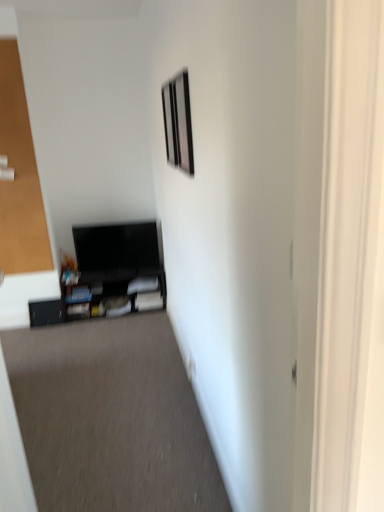
The width and height of the screenshot is (384, 512). What do you see at coordinates (111, 418) in the screenshot?
I see `black cardboard box at lower left` at bounding box center [111, 418].

This screenshot has height=512, width=384. I want to click on matte black picture frame at upper center, which is the second picture frame in front-to-back order, so click(170, 122).

The width and height of the screenshot is (384, 512). I want to click on black cardboard box at lower left, so click(x=111, y=418).

Does black cardboard box at lower left turn towards matte black entertainment center at lower left?

No, black cardboard box at lower left is not aimed at matte black entertainment center at lower left.

From a real-world perspective, is black cardboard box at lower left below matte black entertainment center at lower left?

Yes, from a real-world perspective, black cardboard box at lower left is below matte black entertainment center at lower left.

Identify the location of plain in front of the matte black entertainment center at lower left. (111, 418).

Which object is further away from the camera, black cardboard box at lower left or matte black entertainment center at lower left?

matte black entertainment center at lower left is behind.

Is matte black picture frame at upper center, the 1th picture frame from the back, wider or thinner than black cardboard box at lower left?

Clearly, matte black picture frame at upper center, the 1th picture frame from the back, has less width compared to black cardboard box at lower left.

Is there a large distance between matte black picture frame at upper center, which is the first picture frame from left to right, and black cardboard box at lower left?

Indeed, matte black picture frame at upper center, which is the first picture frame from left to right, is not near black cardboard box at lower left.

The image size is (384, 512). Identify the location of picture frame that is the 2nd one when counting upward from the black cardboard box at lower left (from the image's perspective). (170, 122).

Based on the photo, measure the distance between matte black picture frame at upper center, the 1th picture frame from the back, and black cardboard box at lower left.

matte black picture frame at upper center, the 1th picture frame from the back, is 1.63 meters from black cardboard box at lower left.

Locate an element on the screen. This screenshot has height=512, width=384. entertainment center located below the matte black picture frame at upper center, the second picture frame when ordered from right to left (from the image's perspective) is located at coordinates (114, 271).

Considering the positions of objects matte black entertainment center at lower left and matte black picture frame at upper center, which is the second picture frame in front-to-back order, in the image provided, who is more to the left, matte black entertainment center at lower left or matte black picture frame at upper center, which is the second picture frame in front-to-back order,?

matte black entertainment center at lower left.

Is matte black entertainment center at lower left far away from matte black picture frame at upper center, which is the first picture frame from left to right?

Yes.

Can matte black picture frame at upper center, which is the first picture frame from left to right, be found inside matte black entertainment center at lower left?

No, matte black picture frame at upper center, which is the first picture frame from left to right, is not surrounded by matte black entertainment center at lower left.

Between metallic silver picture frame at upper center, arranged as the 2th picture frame when viewed from the back, and matte black picture frame at upper center, the second picture frame when ordered from right to left, which one has less height?

matte black picture frame at upper center, the second picture frame when ordered from right to left, is shorter.

From the image's perspective, which is below, metallic silver picture frame at upper center, marked as the 2th picture frame in a left-to-right arrangement, or matte black picture frame at upper center, which is the second picture frame in front-to-back order?

metallic silver picture frame at upper center, marked as the 2th picture frame in a left-to-right arrangement, from the image's perspective.

What's the angular difference between metallic silver picture frame at upper center, arranged as the 2th picture frame when viewed from the back, and matte black picture frame at upper center, the second picture frame when ordered from right to left,'s facing directions?

The facing directions of metallic silver picture frame at upper center, arranged as the 2th picture frame when viewed from the back, and matte black picture frame at upper center, the second picture frame when ordered from right to left, are 0.0203 degrees apart.

Is metallic silver picture frame at upper center, marked as the 2th picture frame in a left-to-right arrangement, looking in the opposite direction of matte black picture frame at upper center, which is the second picture frame in front-to-back order?

metallic silver picture frame at upper center, marked as the 2th picture frame in a left-to-right arrangement, is not turned away from matte black picture frame at upper center, which is the second picture frame in front-to-back order.

From a real-world perspective, between metallic silver picture frame at upper center, marked as the 2th picture frame in a left-to-right arrangement, and black cardboard box at lower left, who is vertically higher?

metallic silver picture frame at upper center, marked as the 2th picture frame in a left-to-right arrangement.

Does metallic silver picture frame at upper center, marked as the 2th picture frame in a left-to-right arrangement, contain black cardboard box at lower left?

No, black cardboard box at lower left is not surrounded by metallic silver picture frame at upper center, marked as the 2th picture frame in a left-to-right arrangement.

Is metallic silver picture frame at upper center, which is counted as the first picture frame, starting from the right, taller or shorter than black cardboard box at lower left?

In the image, metallic silver picture frame at upper center, which is counted as the first picture frame, starting from the right, appears to be taller than black cardboard box at lower left.

In the scene shown: Is metallic silver picture frame at upper center, marked as the 2th picture frame in a left-to-right arrangement, oriented away from black cardboard box at lower left?

That's not correct — metallic silver picture frame at upper center, marked as the 2th picture frame in a left-to-right arrangement, is not looking away from black cardboard box at lower left.

From the image's perspective, between transparent glass door at left and metallic silver picture frame at upper center, which is counted as the first picture frame, starting from the right, who is located below?

From the image's view, metallic silver picture frame at upper center, which is counted as the first picture frame, starting from the right, is below.

Does transparent glass door at left contain metallic silver picture frame at upper center, marked as the 2th picture frame in a left-to-right arrangement?

No, metallic silver picture frame at upper center, marked as the 2th picture frame in a left-to-right arrangement, is located outside of transparent glass door at left.

Between transparent glass door at left and metallic silver picture frame at upper center, arranged as the 2th picture frame when viewed from the back, which one appears on the right side from the viewer's perspective?

From the viewer's perspective, metallic silver picture frame at upper center, arranged as the 2th picture frame when viewed from the back, appears more on the right side.

Is matte black entertainment center at lower left facing away from transparent glass door at left?

No, matte black entertainment center at lower left is not facing the opposite direction of transparent glass door at left.

From a real-world perspective, relative to transparent glass door at left, is matte black entertainment center at lower left vertically above or below?

From a real-world perspective, matte black entertainment center at lower left is physically below transparent glass door at left.

In the scene shown: How many degrees apart are the facing directions of matte black entertainment center at lower left and transparent glass door at left?

They differ by 0.695 degrees in their facing directions.

From the image's perspective, is matte black entertainment center at lower left above transparent glass door at left?

Actually, matte black entertainment center at lower left appears below transparent glass door at left in the image.

Where is `plain located in front of the matte black entertainment center at lower left`? This screenshot has width=384, height=512. plain located in front of the matte black entertainment center at lower left is located at coordinates (111, 418).

From the image's perspective, count 2nd picture frames upward from the black cardboard box at lower left and point to it. Please provide its 2D coordinates.

[(170, 122)]

Estimate the real-world distances between objects in this image. Which object is further from black cardboard box at lower left, transparent glass door at left or metallic silver picture frame at upper center, which is counted as the first picture frame, starting from the right?

metallic silver picture frame at upper center, which is counted as the first picture frame, starting from the right, lies further to black cardboard box at lower left than the other object.

Looking at the image, which one is located closer to metallic silver picture frame at upper center, arranged as the 2th picture frame when viewed from the back, black cardboard box at lower left or matte black picture frame at upper center, the second picture frame when ordered from right to left?

matte black picture frame at upper center, the second picture frame when ordered from right to left.

Looking at the image, which one is located closer to black cardboard box at lower left, metallic silver picture frame at upper center, which is counted as the first picture frame, starting from the right, or matte black picture frame at upper center, the second picture frame when ordered from right to left?

metallic silver picture frame at upper center, which is counted as the first picture frame, starting from the right, is closer to black cardboard box at lower left.

Based on their spatial positions, is transparent glass door at left or metallic silver picture frame at upper center, which ranks as the 1th picture frame in front-to-back order, further from matte black picture frame at upper center, which is the second picture frame in front-to-back order?

The object further to matte black picture frame at upper center, which is the second picture frame in front-to-back order, is transparent glass door at left.

Looking at the image, which one is located closer to matte black entertainment center at lower left, matte black picture frame at upper center, which is the first picture frame from left to right, or black cardboard box at lower left?

black cardboard box at lower left is closer to matte black entertainment center at lower left.

Looking at the image, which one is located further to black cardboard box at lower left, matte black entertainment center at lower left or matte black picture frame at upper center, the 1th picture frame from the back?

Based on the image, matte black picture frame at upper center, the 1th picture frame from the back, appears to be further to black cardboard box at lower left.

Estimate the real-world distances between objects in this image. Which object is further from matte black entertainment center at lower left, metallic silver picture frame at upper center, arranged as the 2th picture frame when viewed from the back, or black cardboard box at lower left?

metallic silver picture frame at upper center, arranged as the 2th picture frame when viewed from the back, is further to matte black entertainment center at lower left.

When comparing their distances from metallic silver picture frame at upper center, which is counted as the first picture frame, starting from the right, does black cardboard box at lower left or matte black entertainment center at lower left seem further?

black cardboard box at lower left lies further to metallic silver picture frame at upper center, which is counted as the first picture frame, starting from the right, than the other object.

Locate an element on the screen. The height and width of the screenshot is (512, 384). picture frame between matte black picture frame at upper center, which is the second picture frame in front-to-back order, and black cardboard box at lower left vertically is located at coordinates (178, 122).

Where is `picture frame between metallic silver picture frame at upper center, which is counted as the first picture frame, starting from the right, and matte black entertainment center at lower left in the front-back direction`? This screenshot has width=384, height=512. picture frame between metallic silver picture frame at upper center, which is counted as the first picture frame, starting from the right, and matte black entertainment center at lower left in the front-back direction is located at coordinates (170, 122).

I want to click on glass door between matte black picture frame at upper center, which is the first picture frame from left to right, and black cardboard box at lower left, in the vertical direction, so click(x=19, y=177).

Locate an element on the screen. Image resolution: width=384 pixels, height=512 pixels. picture frame situated between transparent glass door at left and metallic silver picture frame at upper center, which is counted as the first picture frame, starting from the right, from left to right is located at coordinates (170, 122).